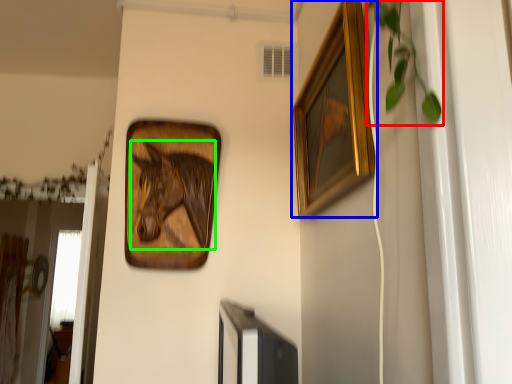
Question: Which is farther away from plant (highlighted by a red box)? picture frame (highlighted by a blue box) or animal (highlighted by a green box)?

Choices:
 (A) picture frame
 (B) animal

Answer: (B)